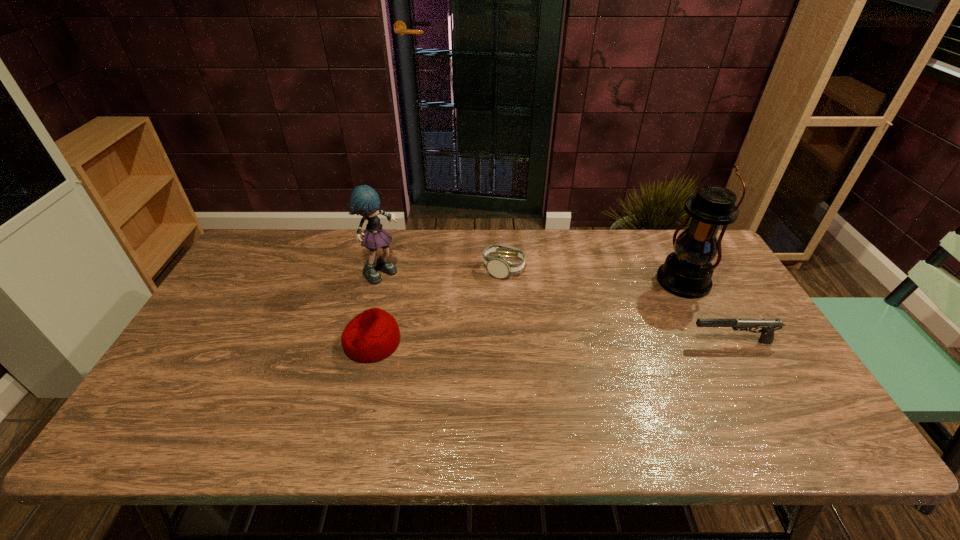
You are a GUI agent. You are given a task and a screenshot of the screen. Output one action in this format:
    pyautogui.click(x=<x>, y=<y>)
    Task: Click on the vacant region between the gun and the third object from left to right
    
    Given the screenshot: What is the action you would take?
    pyautogui.click(x=618, y=306)

Identify which object is the fourth closest to the third object from right to left. Please provide its 2D coordinates. Your answer should be formatted as a tuple, i.e. [(x, y)], where the tuple contains the x and y coordinates of a point satisfying the conditions above.

[(768, 326)]

Locate an element on the screen. The image size is (960, 540). object that stands as the second closest to the lantern is located at coordinates (499, 267).

Identify the location of vacant region that satisfies the following two spatial constraints: 1. on the front side of the gun; 2. at the muzzle end of the second tallest object. The height and width of the screenshot is (540, 960). (365, 342).

This screenshot has height=540, width=960. I want to click on vacant area in the image that satisfies the following two spatial constraints: 1. on the front side of the tallest object; 2. on the right side of the third object from left to right, so click(504, 281).

Locate an element on the screen. The width and height of the screenshot is (960, 540). free spot that satisfies the following two spatial constraints: 1. on the front side of the second tallest object; 2. on the right side of the lantern is located at coordinates (380, 281).